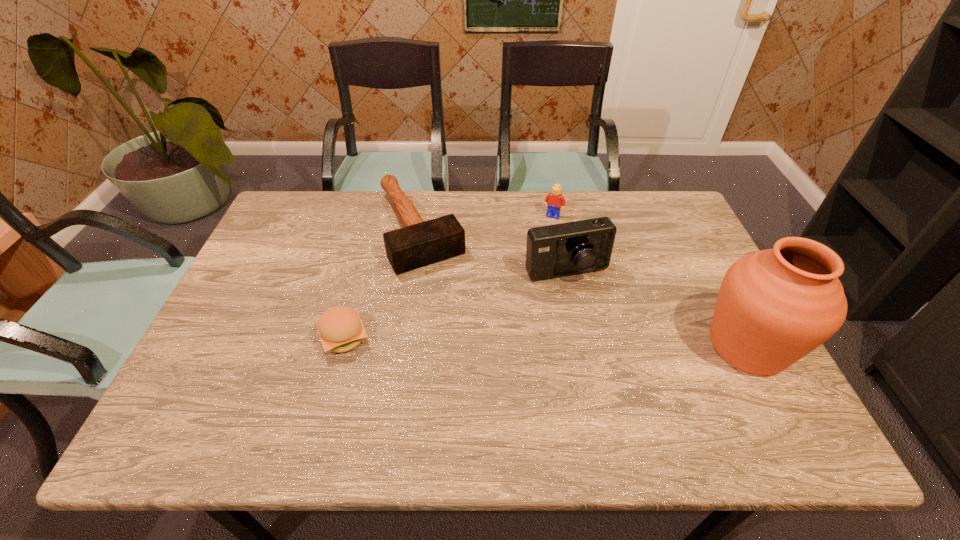
The height and width of the screenshot is (540, 960). Find the location of `unoccupied position between the mallet and the Lego`. unoccupied position between the mallet and the Lego is located at coordinates (486, 222).

Locate an element on the screen. This screenshot has height=540, width=960. vacant space that is in between the second tallest object and the rightmost object is located at coordinates (657, 309).

This screenshot has width=960, height=540. Identify the location of vacant point located between the camera and the tallest object. (657, 309).

Find the location of `free space that is in between the mallet and the fourth shortest object`. free space that is in between the mallet and the fourth shortest object is located at coordinates (493, 250).

Find the location of `vacant area that lies between the tallest object and the second tallest object`. vacant area that lies between the tallest object and the second tallest object is located at coordinates (657, 309).

Find the location of a particular element. This screenshot has width=960, height=540. unoccupied area between the third tallest object and the hamburger is located at coordinates (448, 277).

I want to click on empty space between the camera and the tallest object, so click(657, 309).

The image size is (960, 540). I want to click on unoccupied area between the third tallest object and the hamburger, so click(448, 277).

Image resolution: width=960 pixels, height=540 pixels. In order to click on the closest object to the mallet in this screenshot , I will do `click(340, 328)`.

At what (x,y) coordinates should I click in order to perform the action: click on the second closest object relative to the urn. Please return your answer as a coordinate pair (x, y). Looking at the image, I should click on (554, 201).